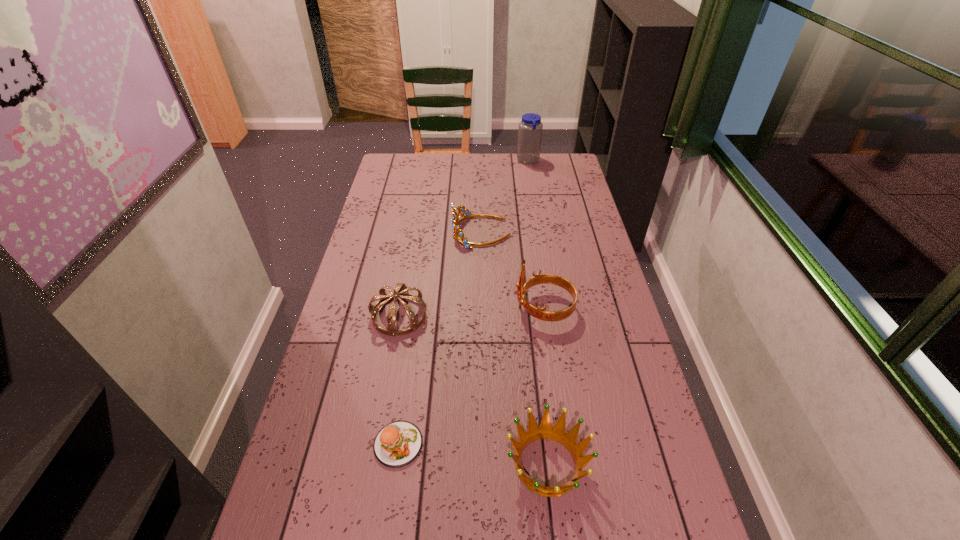
What are the coordinates of `vacant area situated on the front-facing side of the tallest tiara` in the screenshot? It's located at (440, 308).

The height and width of the screenshot is (540, 960). I want to click on vacant space located on the front-facing side of the tallest tiara, so click(x=461, y=308).

This screenshot has height=540, width=960. What are the coordinates of `free region located 0.210m on the front-facing side of the second farthest object` in the screenshot? It's located at (397, 232).

The width and height of the screenshot is (960, 540). In order to click on blank area located on the front-facing side of the second farthest object in this screenshot , I will do `click(434, 232)`.

Image resolution: width=960 pixels, height=540 pixels. I want to click on vacant space located on the front-facing side of the second farthest object, so point(390,232).

Image resolution: width=960 pixels, height=540 pixels. I want to click on free location located 0.110m on the front of the leftmost tiara, so click(x=390, y=368).

This screenshot has height=540, width=960. I want to click on free location located 0.180m on the left of the fifth tallest object, so click(429, 464).

The height and width of the screenshot is (540, 960). I want to click on vacant space located on the left of the patty, so click(x=341, y=444).

Locate an element on the screen. object positioned at the far edge is located at coordinates (530, 128).

Locate an element on the screen. Image resolution: width=960 pixels, height=540 pixels. object located in the left edge section of the desktop is located at coordinates (401, 291).